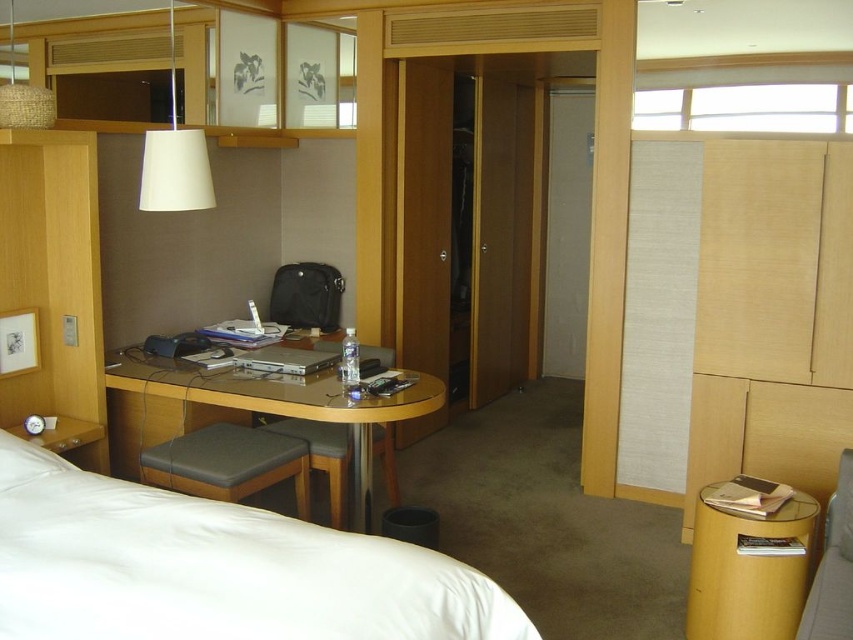
You are a guest in this hotel room and want to place a 10 inch wide laptop bag between the wooden polished table at center and the dark gray leather stool at lower center. Is there enough space for the bag?

The wooden polished table at center is 11.07 inches away from the dark gray leather stool at lower center, so yes, there is enough space to place a 10 inch wide laptop bag between them since the distance is greater than the bag width.

You are a guest in this hotel room and want to place a small nightstand between the white smooth bed at lower left and the matte beige lampshade at upper left. Is this possible based on their positions?

The white smooth bed at lower left is positioned on the right side of matte beige lampshade at upper left, so there is no space between them to place a nightstand.

You are standing in the hotel room and want to place a new lamp on the wooden polished table at center. Given that the table is at coordinates point [283,403], where exactly should you go to place the lamp?

The wooden polished table at center is located at point [283,403], so you should go to those coordinates to place the new lamp there.